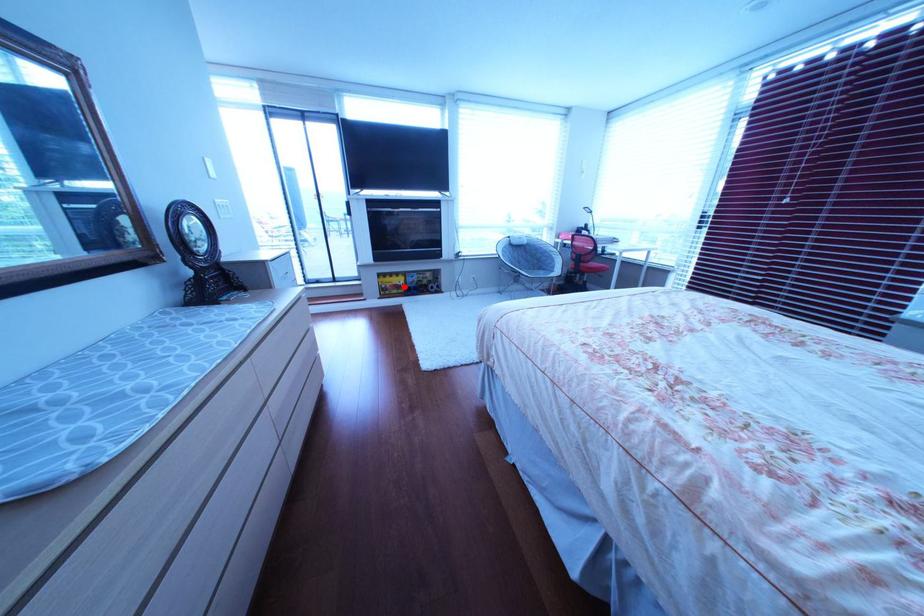
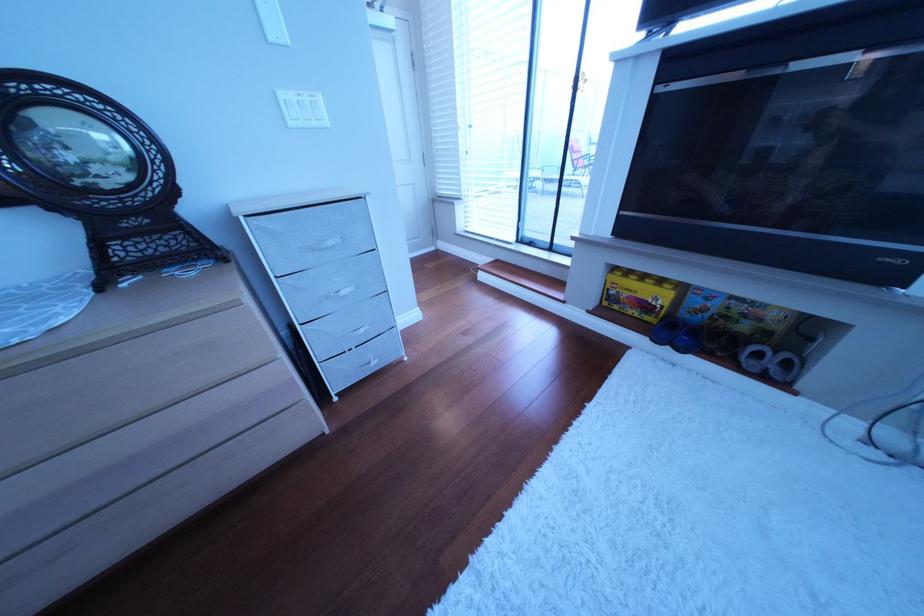
Question: I am providing you with two images of the same scene from different viewpoints. Image1 has a red point marked. In image2, the corresponding 3D location appears at what relative position? Reply with the corresponding letter.

Choices:
 (A) Closer
 (B) Farther

Answer: (B)